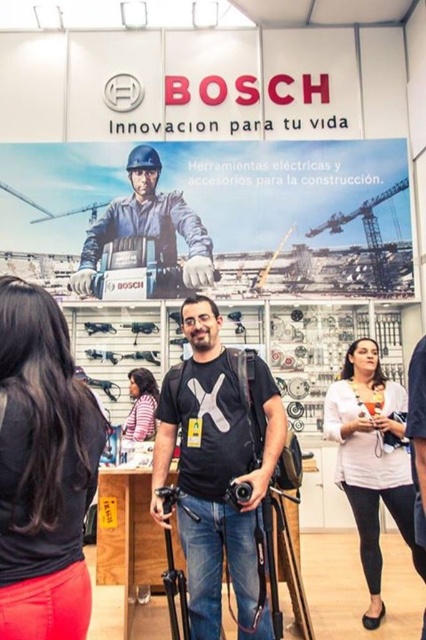
Question: Which point is farther to the camera?

Choices:
 (A) black matte t-shirt at center
 (B) pink fabric shirt at lower left

Answer: (B)

Question: Can you confirm if black matte t-shirt at center is positioned to the right of black plastic video camera at center?

Choices:
 (A) yes
 (B) no

Answer: (B)

Question: Is matte plastic poster at upper center behind white matte shirt at lower right?

Choices:
 (A) yes
 (B) no

Answer: (A)

Question: Estimate the real-world distances between objects in this image. Which object is farther from the black matte tripod at center?

Choices:
 (A) pink fabric shirt at lower left
 (B) black matte t-shirt at center
 (C) black plastic video camera at center

Answer: (A)

Question: Can you confirm if matte black helmet at upper center is thinner than black plastic video camera at center?

Choices:
 (A) yes
 (B) no

Answer: (B)

Question: Which object appears farthest from the camera in this image?

Choices:
 (A) black matte tripod at center
 (B) black matte t-shirt at center
 (C) black plastic video camera at center

Answer: (A)